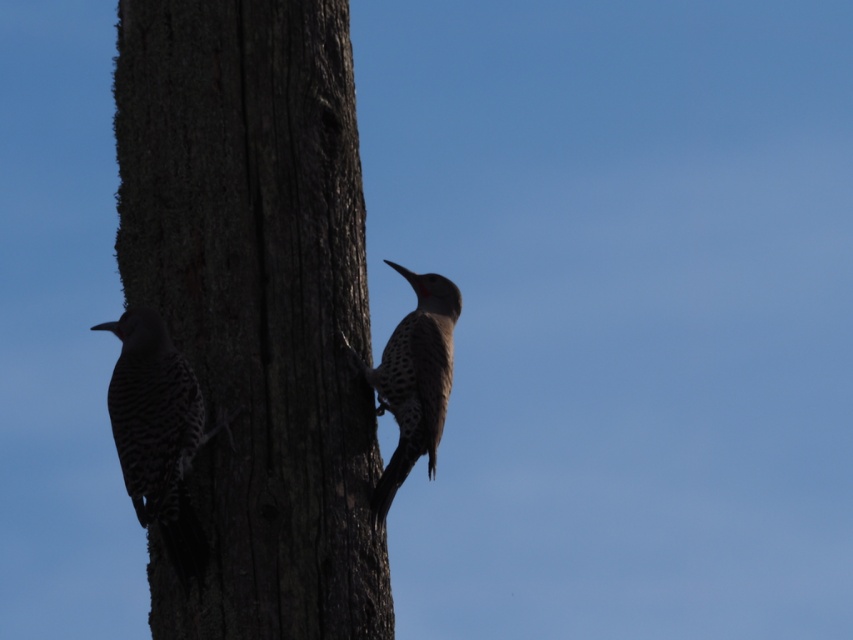
Can you confirm if smooth bark tree trunk at center is shorter than spotted feathered woodpecker at center?

In fact, smooth bark tree trunk at center may be taller than spotted feathered woodpecker at center.

Does smooth bark tree trunk at center have a larger size compared to spotted feathered woodpecker at center?

Yes, smooth bark tree trunk at center is bigger than spotted feathered woodpecker at center.

Who is more distant from viewer, (317, 35) or (380, 513)?

The point (317, 35) is more distant.

The height and width of the screenshot is (640, 853). I want to click on smooth bark tree trunk at center, so click(x=256, y=305).

Does point (192, 385) lie in front of point (434, 317)?

Yes, it is.

Does speckled brown woodpecker at left have a larger size compared to spotted feathered woodpecker at center?

Actually, speckled brown woodpecker at left might be smaller than spotted feathered woodpecker at center.

Where is `speckled brown woodpecker at left`? The height and width of the screenshot is (640, 853). speckled brown woodpecker at left is located at coordinates (158, 433).

Does smooth bark tree trunk at center have a greater height compared to speckled brown woodpecker at left?

Correct, smooth bark tree trunk at center is much taller as speckled brown woodpecker at left.

Does point (289, 51) come in front of point (161, 333)?

No, it is not.

Is point (212, 154) closer to viewer compared to point (173, 356)?

No.

Identify the location of smooth bark tree trunk at center. tap(256, 305).